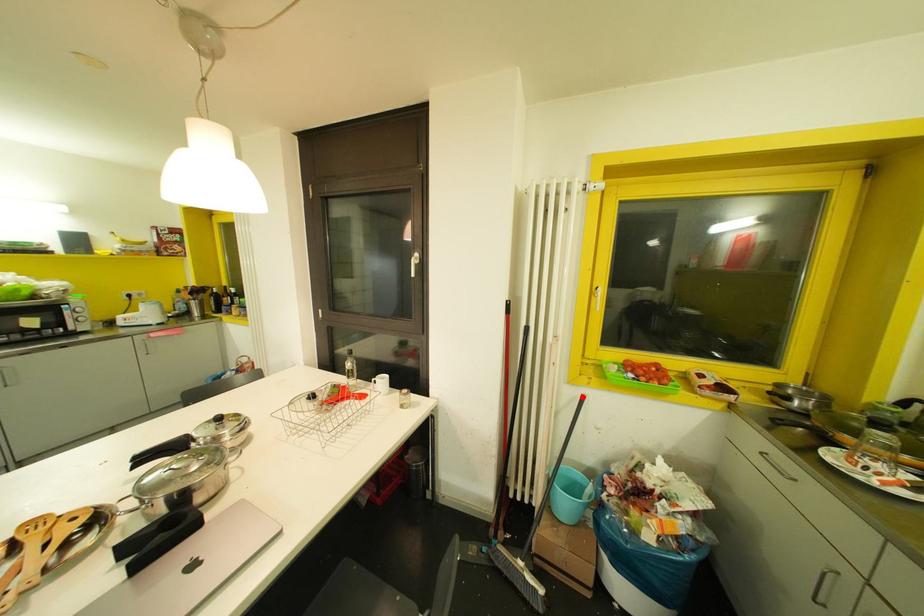
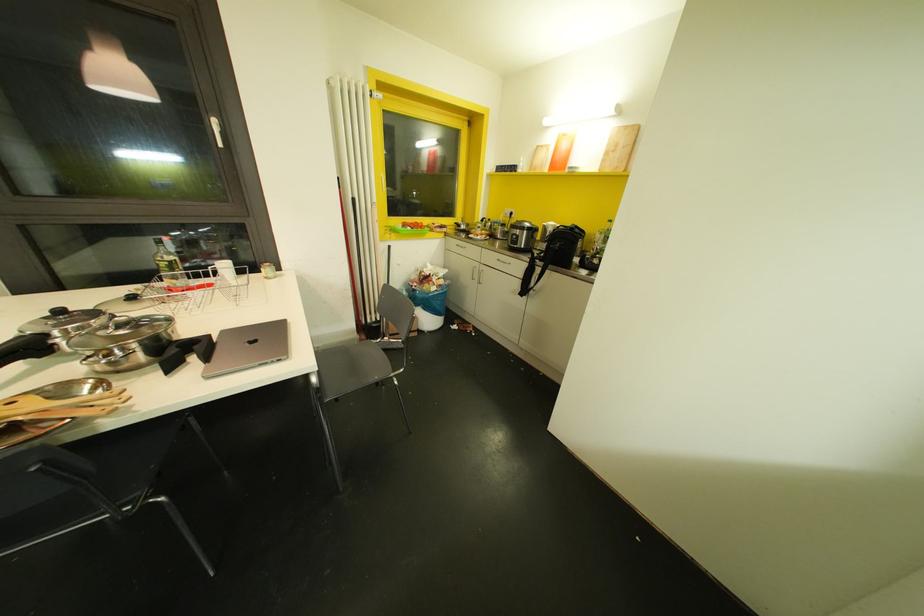
Locate, in the second image, the point that corresponds to the highlighted location in the first image.

(388, 246)